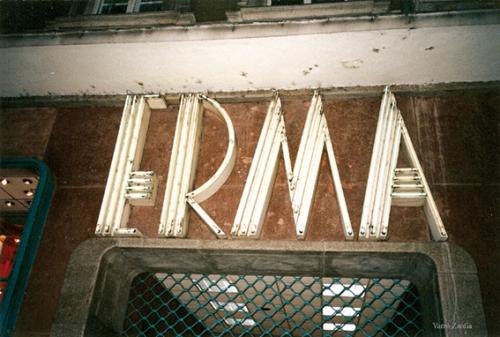
Identify the location of ceiling. The image size is (500, 337). (296, 293).